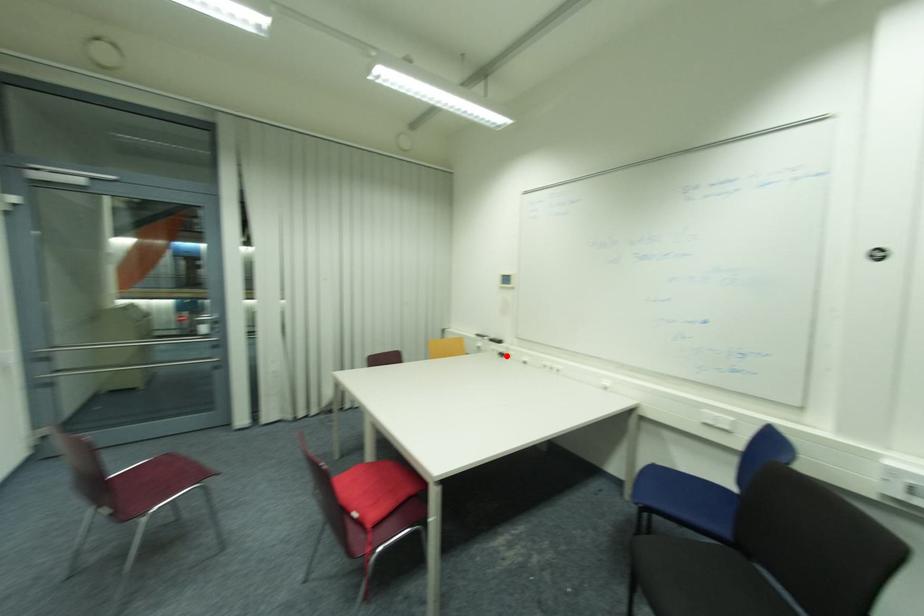
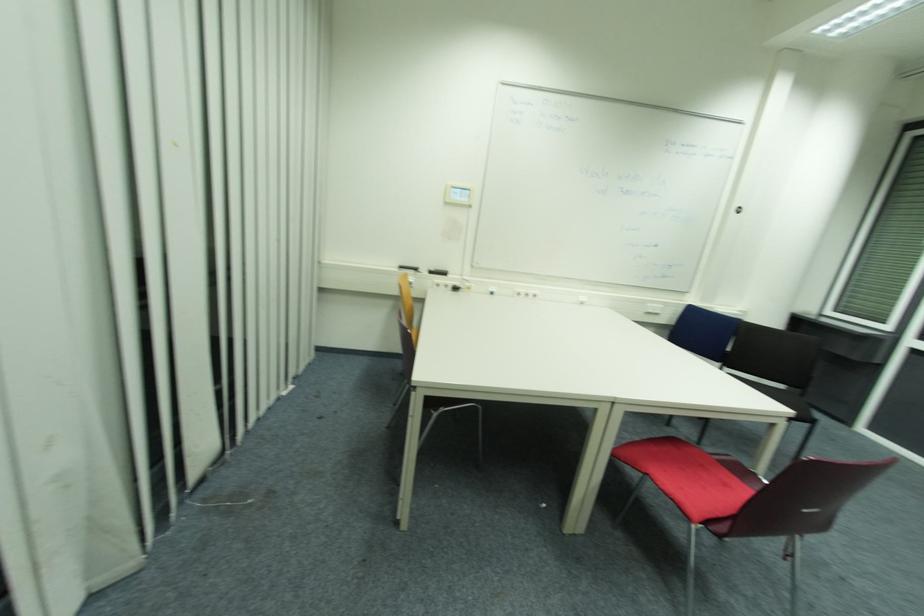
Question: I am providing you with two images of the same scene from different viewpoints. A red point is shown in image1. For the corresponding object point in image2, is it positioned nearer or farther from the camera?

Choices:
 (A) Nearer
 (B) Farther

Answer: (A)